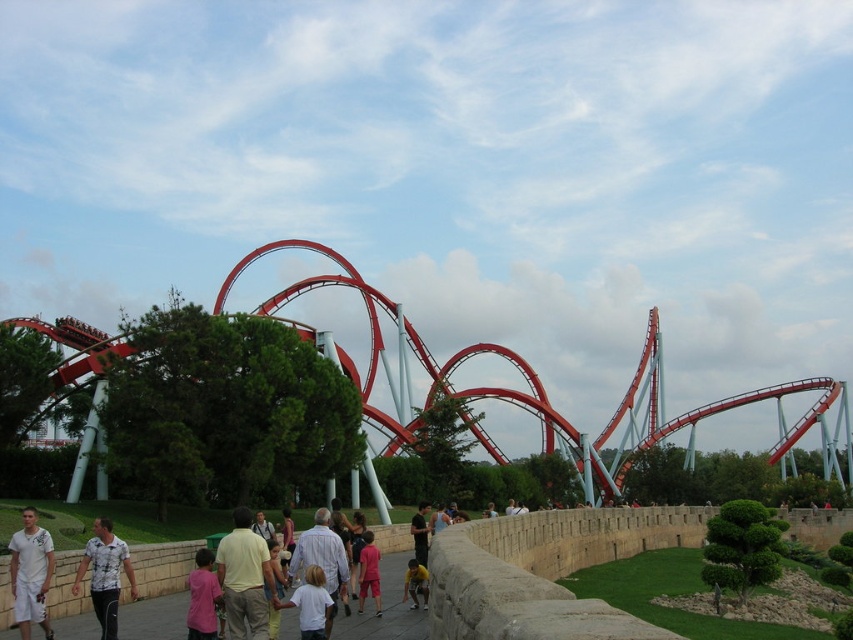
Question: Based on their relative distances, which object is nearer to the black shirt at center?

Choices:
 (A) white printed shirt at lower left
 (B) light yellow shirt at center
 (C) white cotton shirt at center

Answer: (C)

Question: Is glossy steel roller coaster at center wider than white printed shirt at lower left?

Choices:
 (A) yes
 (B) no

Answer: (A)

Question: Does light yellow shirt at center have a larger size compared to white cotton shirt at lower left?

Choices:
 (A) no
 (B) yes

Answer: (A)

Question: Is glossy steel roller coaster at center further to camera compared to white printed shirt at lower left?

Choices:
 (A) no
 (B) yes

Answer: (B)

Question: Which point appears farthest from the camera in this image?

Choices:
 (A) coord(418,572)
 (B) coord(33,548)
 (C) coord(229,621)

Answer: (A)

Question: Among these points, which one is farthest from the camera?

Choices:
 (A) (360, 560)
 (B) (13, 536)
 (C) (419, 515)
 (D) (167, 621)

Answer: (C)